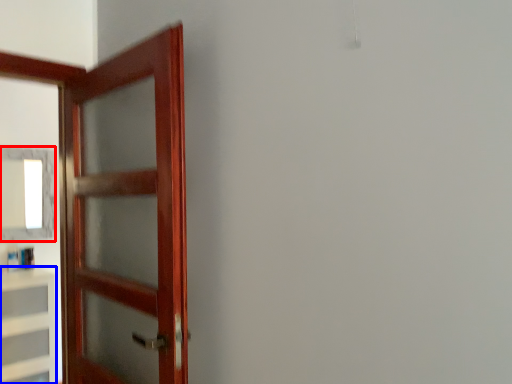
Question: Which of the following is the closest to the observer, mirror (highlighted by a red box) or cabinetry (highlighted by a blue box)?

Choices:
 (A) mirror
 (B) cabinetry

Answer: (B)